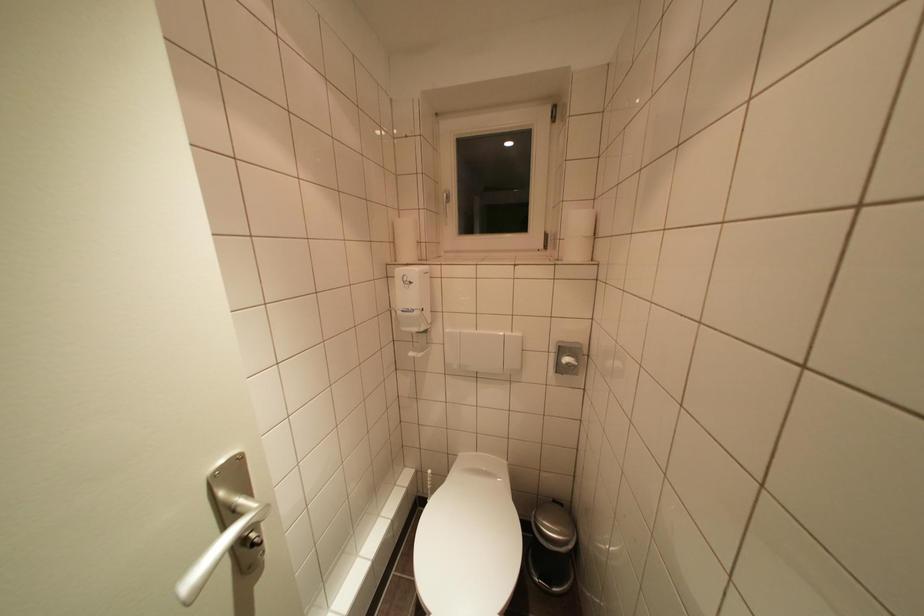
I want to click on white toilet lid, so click(468, 541).